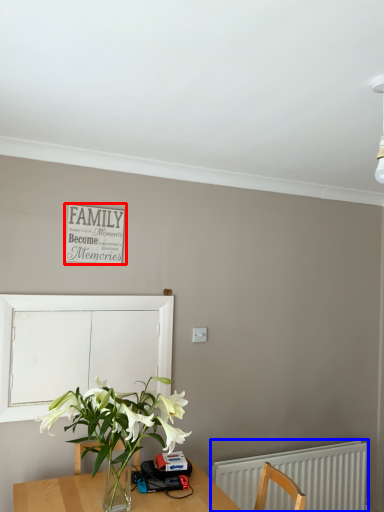
Question: Which object is closer to the camera taking this photo, bulletin board (highlighted by a red box) or radiator (highlighted by a blue box)?

Choices:
 (A) bulletin board
 (B) radiator

Answer: (A)